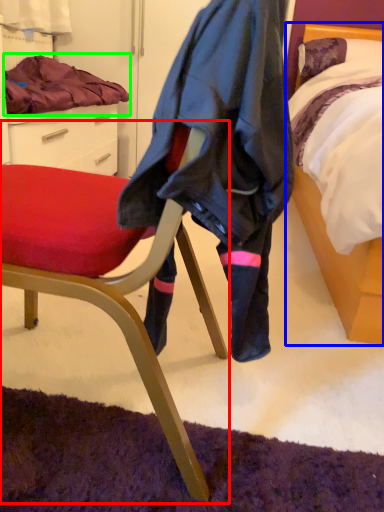
Question: Which object is the farthest from chair (highlighted by a red box)? Choose among these: bed (highlighted by a blue box) or blanket (highlighted by a green box).

Choices:
 (A) bed
 (B) blanket

Answer: (B)